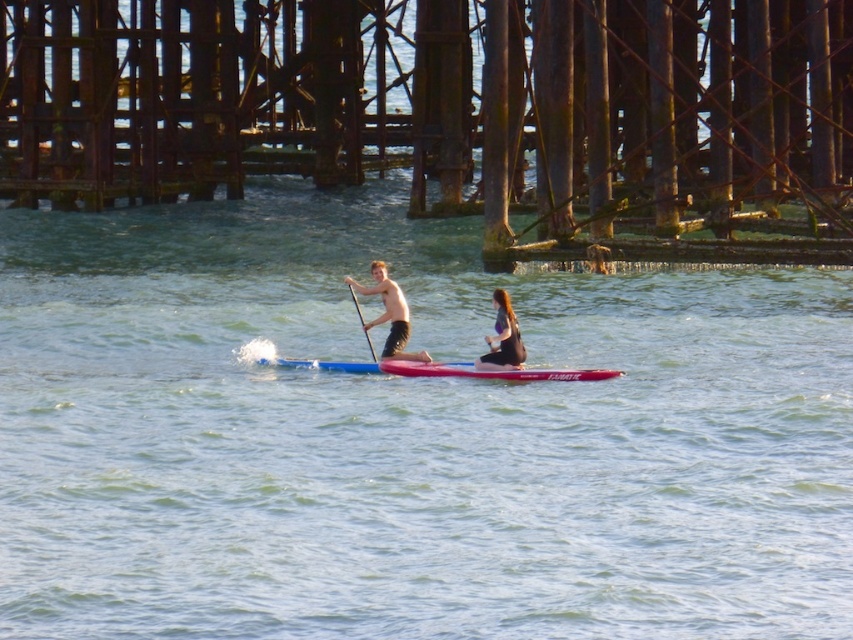
Can you confirm if clear blue water at center is taller than shiny black paddleboard at center?

Yes.

Which is behind, point (161, 324) or point (422, 349)?

Positioned behind is point (161, 324).

Is point (764, 600) less distant than point (384, 305)?

Yes, point (764, 600) is closer to viewer.

Locate an element on the screen. This screenshot has width=853, height=640. clear blue water at center is located at coordinates (407, 436).

Based on the photo, who is more distant from viewer, (433,371) or (375,358)?

Positioned behind is point (375,358).

The width and height of the screenshot is (853, 640). In order to click on red glossy paddleboard at center in this screenshot , I will do `click(491, 371)`.

The height and width of the screenshot is (640, 853). I want to click on red glossy paddleboard at center, so click(491, 371).

Does clear blue water at center appear on the right side of matte black wetsuit at center?

Incorrect, clear blue water at center is not on the right side of matte black wetsuit at center.

Which of these two, clear blue water at center or matte black wetsuit at center, stands taller?

clear blue water at center is taller.

Which is behind, point (57, 218) or point (511, 369)?

Positioned behind is point (57, 218).

You are a GUI agent. You are given a task and a screenshot of the screen. Output one action in this format:
    pyautogui.click(x=<x>, y=<y>)
    Task: Click on the clear blue water at center
    This screenshot has height=640, width=853.
    Given the screenshot: What is the action you would take?
    pyautogui.click(x=407, y=436)